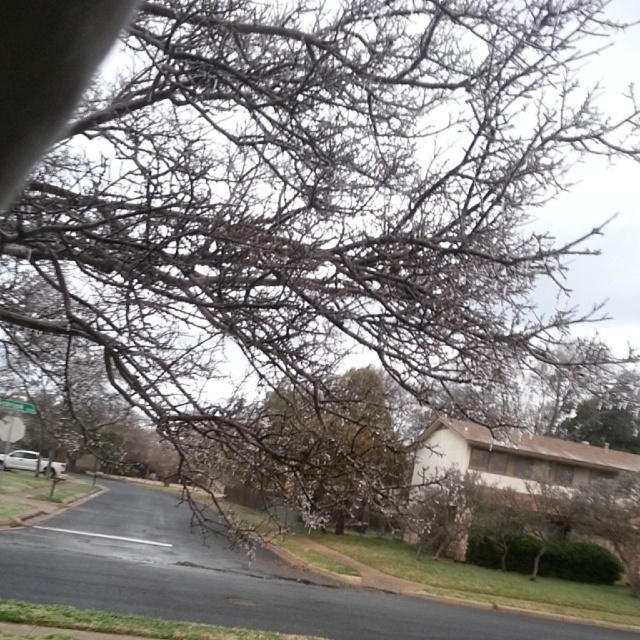
You are standing at the center of the image. Which direction should you move to reach the silver metallic car at lower left?

You should move to the lower left direction to reach the silver metallic car at lower left because it is located at point (29, 461), which is in the lower left quadrant of the image.

You are a delivery driver who needs to park your 5.5 meter long truck between the silver metallic car at lower left and the green plastic street sign at lower left. Is there enough space between them to park your truck?

The distance between the silver metallic car at lower left and the green plastic street sign at lower left is 19.65 meters. Since the truck is only 5.5 meters long, there is ample space to park between them.

You are a pedestrian standing on the sidewalk and want to cross the street. You see a silver metallic car at lower left and a green plastic street sign at lower left. Which object is closer to you?

The silver metallic car at lower left is closer to you because it is further to the viewer than the green plastic street sign at lower left.